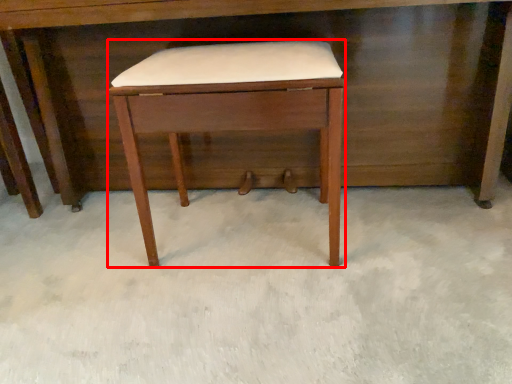
Question: From the image's perspective, where is stool (annotated by the red box) located in relation to desk in the image?

Choices:
 (A) above
 (B) below

Answer: (B)